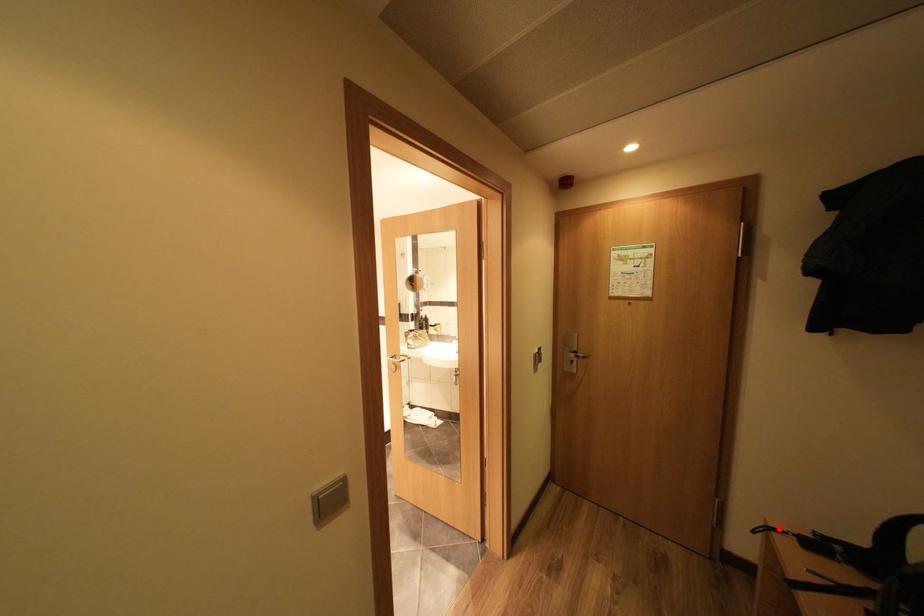
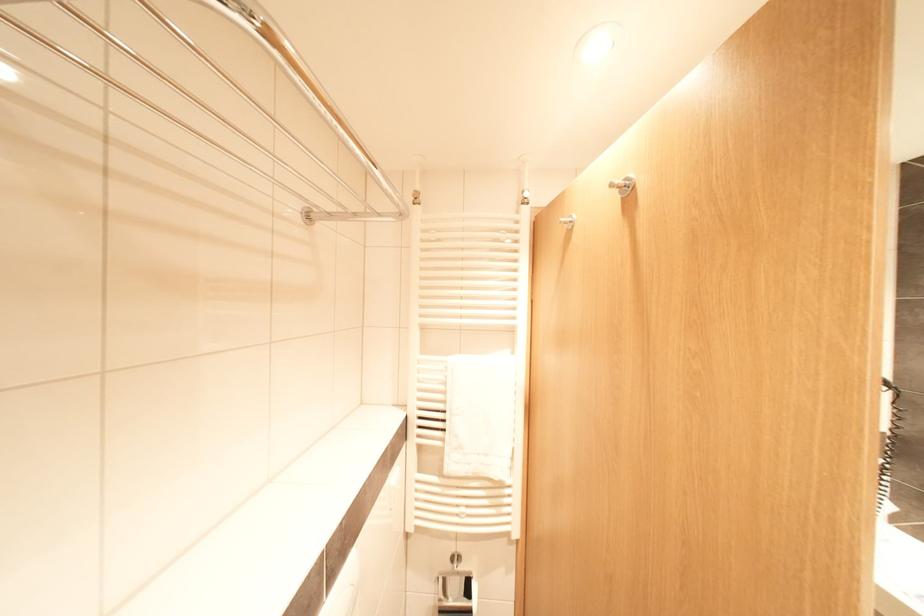
Question: I am providing you with two images of the same scene from different viewpoints. A red point is marked on the first image. At the location where the point appears in image 1, is it still visible in image 2?

Choices:
 (A) Yes
 (B) No

Answer: (B)